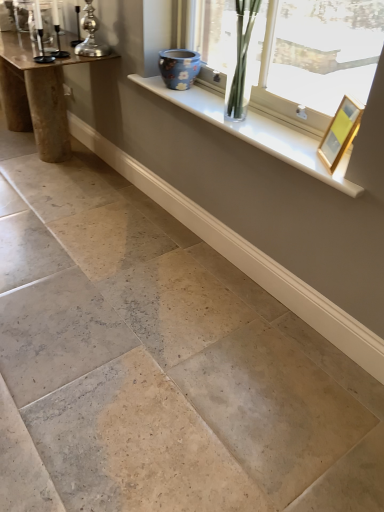
Question: Considering the relative sizes of clear glass vase at upper center and blue floral ceramic vase at upper center in the image provided, is clear glass vase at upper center bigger than blue floral ceramic vase at upper center?

Choices:
 (A) yes
 (B) no

Answer: (A)

Question: Is the position of clear glass vase at upper center less distant than that of blue floral ceramic vase at upper center?

Choices:
 (A) no
 (B) yes

Answer: (B)

Question: Can you confirm if clear glass vase at upper center is wider than blue floral ceramic vase at upper center?

Choices:
 (A) no
 (B) yes

Answer: (B)

Question: Is clear glass vase at upper center not near blue floral ceramic vase at upper center?

Choices:
 (A) no
 (B) yes

Answer: (A)

Question: Is clear glass vase at upper center behind blue floral ceramic vase at upper center?

Choices:
 (A) no
 (B) yes

Answer: (A)

Question: Is clear glass vase at upper center surrounding blue floral ceramic vase at upper center?

Choices:
 (A) no
 (B) yes

Answer: (A)

Question: Does natural stone floor at center have a greater width compared to gold metallic picture frame at upper right?

Choices:
 (A) yes
 (B) no

Answer: (A)

Question: Can you confirm if natural stone floor at center is smaller than gold metallic picture frame at upper right?

Choices:
 (A) no
 (B) yes

Answer: (A)

Question: Considering the relative positions of natural stone floor at center and gold metallic picture frame at upper right in the image provided, is natural stone floor at center in front of gold metallic picture frame at upper right?

Choices:
 (A) yes
 (B) no

Answer: (A)

Question: Considering the relative sizes of natural stone floor at center and gold metallic picture frame at upper right in the image provided, is natural stone floor at center shorter than gold metallic picture frame at upper right?

Choices:
 (A) yes
 (B) no

Answer: (A)

Question: From the image's perspective, does natural stone floor at center appear higher than gold metallic picture frame at upper right?

Choices:
 (A) yes
 (B) no

Answer: (B)

Question: From a real-world perspective, is natural stone floor at center located higher than gold metallic picture frame at upper right?

Choices:
 (A) yes
 (B) no

Answer: (B)

Question: Can you confirm if silver metallic candle holder at upper left, arranged as the first candle holder when viewed from the right, is smaller than natural stone floor at center?

Choices:
 (A) no
 (B) yes

Answer: (B)